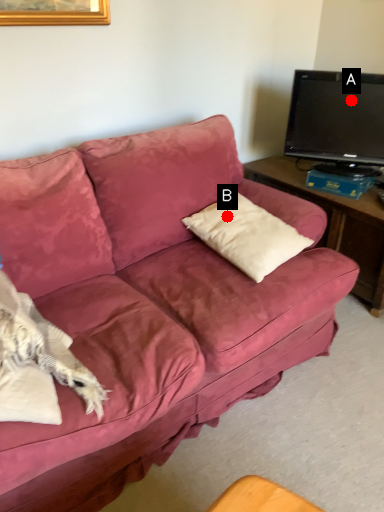
Question: Two points are circled on the image, labeled by A and B beside each circle. Which point is closer to the camera taking this photo?

Choices:
 (A) A is closer
 (B) B is closer

Answer: (B)